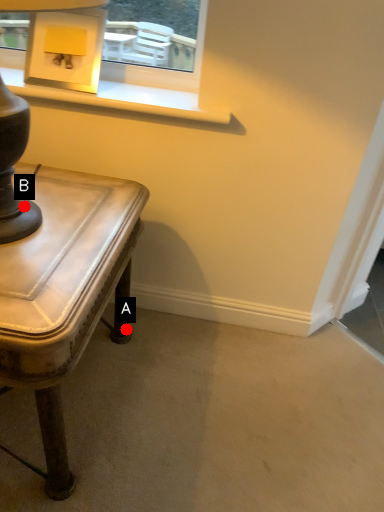
Question: Two points are circled on the image, labeled by A and B beside each circle. Which point is closer to the camera?

Choices:
 (A) A is closer
 (B) B is closer

Answer: (B)